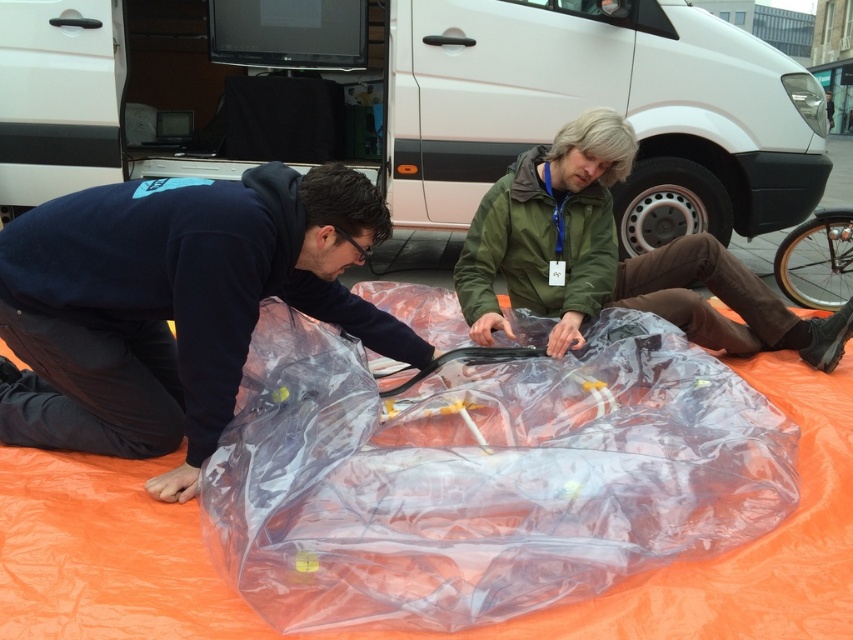
Who is more forward, [113,422] or [524,196]?

Point [113,422]

Image resolution: width=853 pixels, height=640 pixels. What do you see at coordinates (173, 304) in the screenshot?
I see `transparent plastic bag at left` at bounding box center [173, 304].

Who is more forward, (231,352) or (589,172)?

Point (231,352) is in front.

I want to click on transparent plastic bag at left, so click(x=173, y=304).

Is white matte van at upper center wider than green matte jacket at center?

Indeed, white matte van at upper center has a greater width compared to green matte jacket at center.

Can you confirm if white matte van at upper center is bigger than green matte jacket at center?

No.

What do you see at coordinates (434, 104) in the screenshot?
I see `white matte van at upper center` at bounding box center [434, 104].

This screenshot has height=640, width=853. Identify the location of white matte van at upper center. (434, 104).

Is transparent plastic wrap at center wider than green matte jacket at center?

Incorrect, transparent plastic wrap at center's width does not surpass green matte jacket at center's.

Does transparent plastic wrap at center appear over green matte jacket at center?

Incorrect, transparent plastic wrap at center is not positioned above green matte jacket at center.

Image resolution: width=853 pixels, height=640 pixels. What are the coordinates of `transparent plastic wrap at center` in the screenshot? It's located at (482, 476).